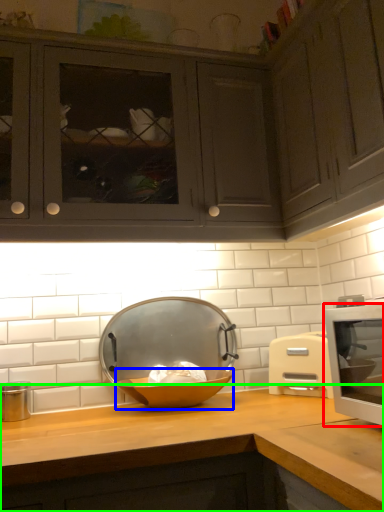
Question: Based on their relative distances, which object is farther from home appliance (highlighted by a red box)? Choose from bowl (highlighted by a blue box) and countertop (highlighted by a green box).

Choices:
 (A) bowl
 (B) countertop

Answer: (A)